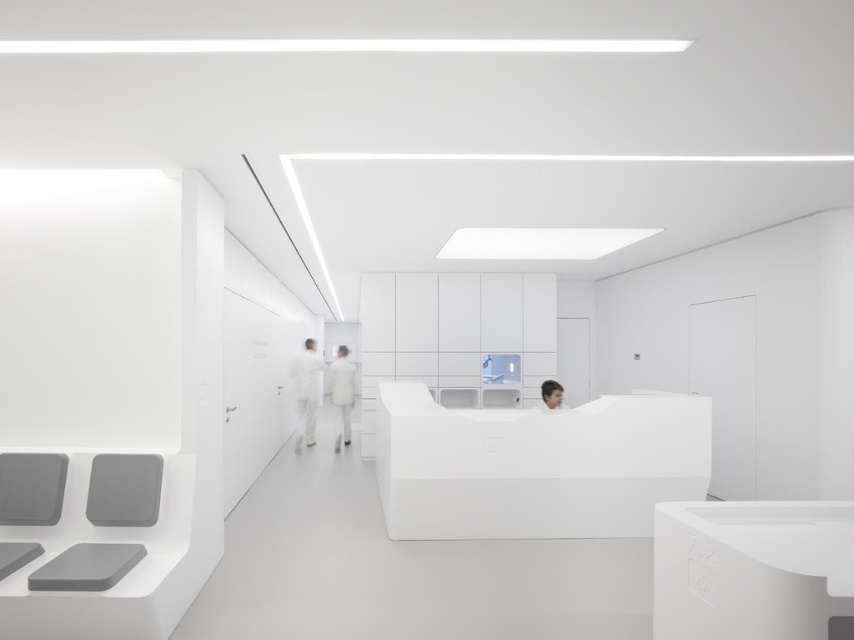
Question: Is matte gray chair at lower left to the right of white matte/soft fabric person at center from the viewer's perspective?

Choices:
 (A) no
 (B) yes

Answer: (B)

Question: Is matte gray chair at lower left below smooth black hair at center?

Choices:
 (A) no
 (B) yes

Answer: (B)

Question: Which point appears farthest from the camera in this image?

Choices:
 (A) (309, 403)
 (B) (341, 369)

Answer: (A)

Question: Can you confirm if white matte/soft fabric person at center is positioned to the right of smooth black hair at center?

Choices:
 (A) yes
 (B) no

Answer: (B)

Question: Among these points, which one is farthest from the camera?

Choices:
 (A) (126, 522)
 (B) (347, 378)
 (C) (548, 406)
 (D) (299, 360)

Answer: (D)

Question: Based on their relative distances, which object is nearer to the matte gray chair at lower left?

Choices:
 (A) white matte uniform at center
 (B) white matte/soft fabric person at center

Answer: (A)